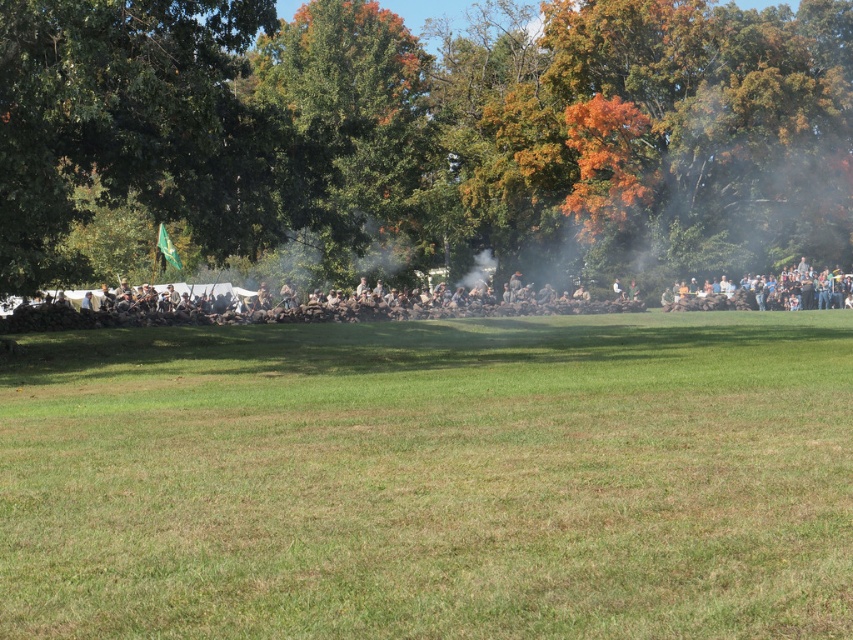
Based on the photo, which is more to the right, green grassy field at center or green leafy tree at upper center?

From the viewer's perspective, green leafy tree at upper center appears more on the right side.

Does green grassy field at center have a smaller size compared to green leafy tree at upper center?

Indeed, green grassy field at center has a smaller size compared to green leafy tree at upper center.

Between point (849, 406) and point (627, 28), which one is positioned in front?

Point (849, 406) is more forward.

At what (x,y) coordinates should I click in order to perform the action: click on green grassy field at center. Please return your answer as a coordinate pair (x, y). The width and height of the screenshot is (853, 640). Looking at the image, I should click on (431, 477).

Is green leafy tree at upper center below brown fabric uniform at center?

Actually, green leafy tree at upper center is above brown fabric uniform at center.

Who is more distant from viewer, (438,28) or (664,301)?

The point (438,28) is more distant.

Who is more forward, (15, 198) or (163, 301)?

Point (15, 198) is in front.

Where is `green leafy tree at upper center`? The height and width of the screenshot is (640, 853). green leafy tree at upper center is located at coordinates (421, 140).

Is point (566, 435) behind point (663, 300)?

No, (566, 435) is in front of (663, 300).

Is point (218, 509) positioned before point (328, 308)?

Yes, point (218, 509) is in front of point (328, 308).

Identify the location of green grassy field at center. (431, 477).